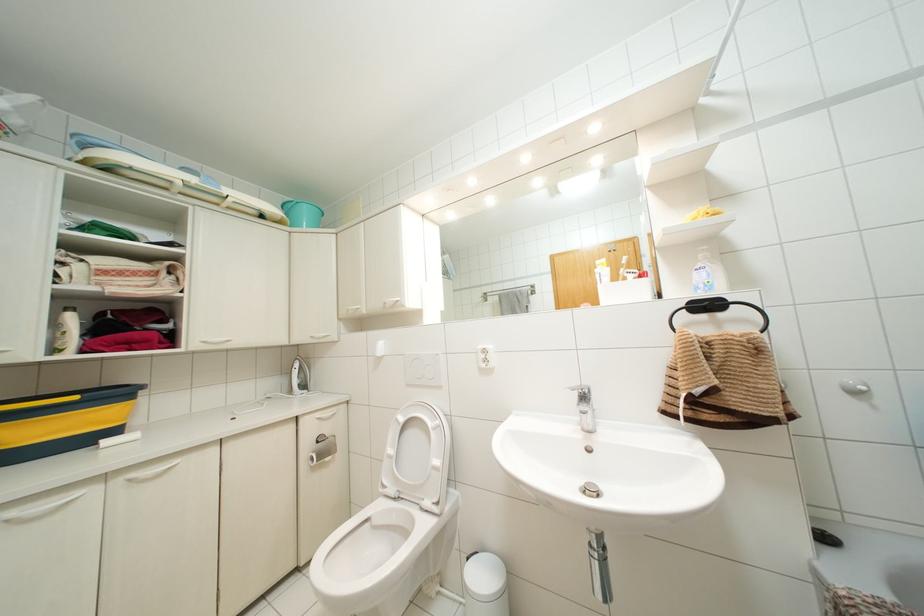
Describe the element at coordinates (417, 369) in the screenshot. I see `the toilet flush button` at that location.